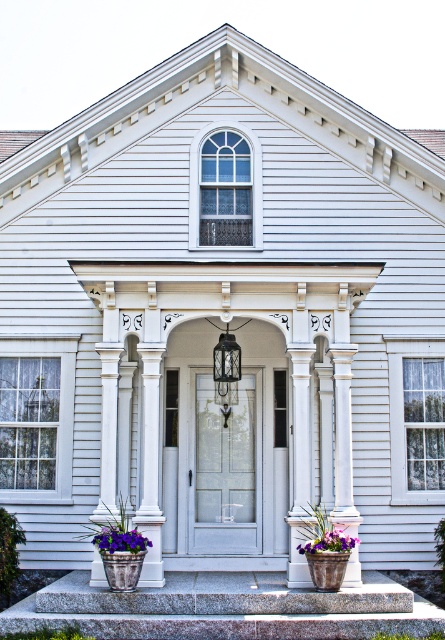
Question: Estimate the real-world distances between objects in this image. Which object is farther from the white frosted glass door at center?

Choices:
 (A) purple fabric flower at lower left
 (B) granite steps at center
 (C) purple fabric flower at lower center

Answer: (A)

Question: Which object is the farthest from the purple fabric flower at lower left?

Choices:
 (A) purple fabric flower at lower center
 (B) granite steps at center

Answer: (A)

Question: Is granite steps at center closer to camera compared to purple fabric flower at lower center?

Choices:
 (A) yes
 (B) no

Answer: (A)

Question: Which is nearer to the purple fabric flower at lower left?

Choices:
 (A) granite steps at center
 (B) purple fabric flower at lower center

Answer: (A)

Question: Can you confirm if purple fabric flower at lower left is thinner than purple fabric flower at lower center?

Choices:
 (A) yes
 (B) no

Answer: (A)

Question: From the image, what is the correct spatial relationship of purple fabric flower at lower left in relation to purple fabric flower at lower center?

Choices:
 (A) above
 (B) below

Answer: (A)